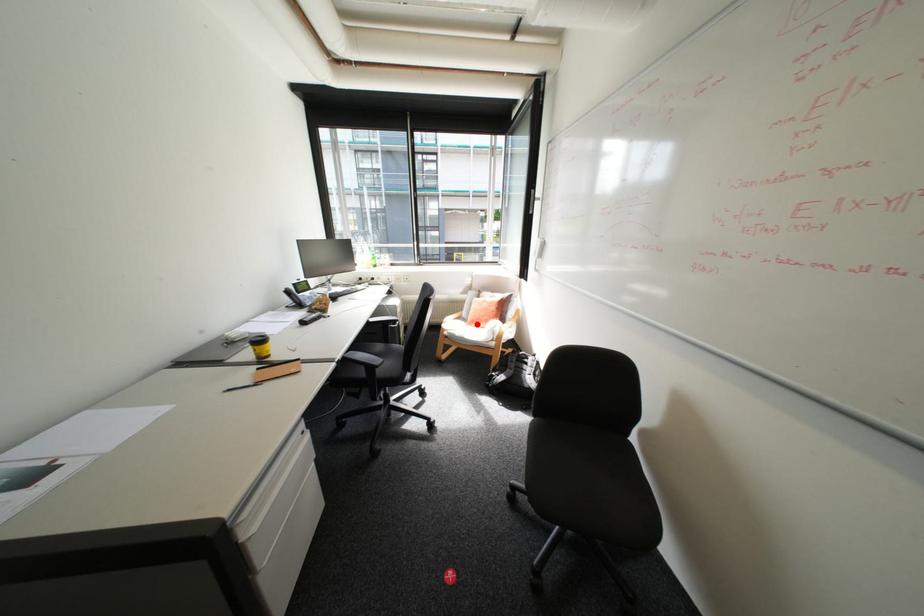
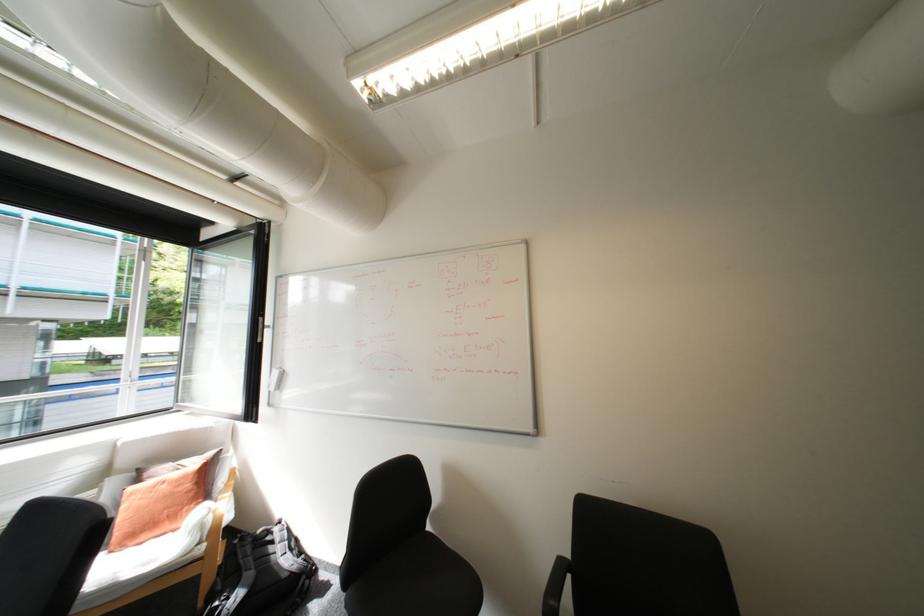
Question: I am providing you with two images of the same scene from different viewpoints. Image1 has a red point marked. In image2, the corresponding 3D location appears at what relative position? Reply with the corresponding letter.

Choices:
 (A) Closer
 (B) Farther

Answer: (B)